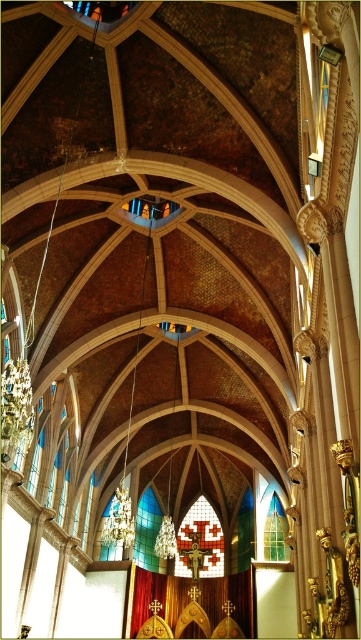
Question: Can you confirm if translucent stained glass at center is positioned above stained glass window at center?

Choices:
 (A) no
 (B) yes

Answer: (B)

Question: Estimate the real-world distances between objects in this image. Which object is closer to the translucent stained glass at center?

Choices:
 (A) stained glass window at center
 (B) multicolored stained glass at center

Answer: (B)

Question: Does translucent stained glass at center come behind multicolored stained glass at center?

Choices:
 (A) no
 (B) yes

Answer: (A)

Question: Does translucent stained glass at center lie in front of stained glass window at center?

Choices:
 (A) no
 (B) yes

Answer: (B)

Question: Which of the following is the farthest from the observer?

Choices:
 (A) (280, 529)
 (B) (111, 547)

Answer: (B)

Question: Which point is farther to the camera?

Choices:
 (A) (146, 538)
 (B) (115, 554)
 (C) (284, 547)

Answer: (A)